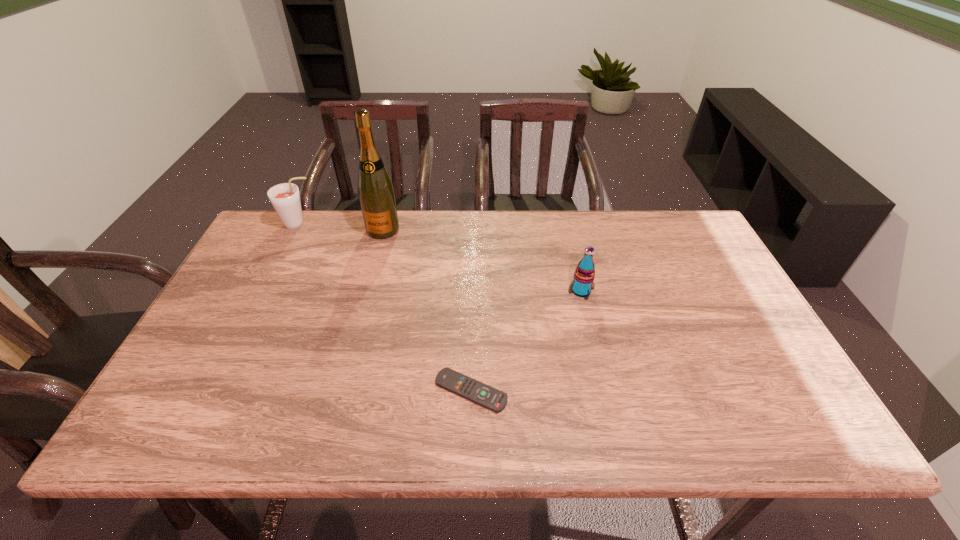
Image resolution: width=960 pixels, height=540 pixels. I want to click on empty location between the tallest object and the leftmost object, so click(x=341, y=227).

The width and height of the screenshot is (960, 540). What are the coordinates of `blank region between the leftmost object and the nearest object` in the screenshot? It's located at 385,308.

Locate an element on the screen. The height and width of the screenshot is (540, 960). vacant space in between the second object from right to left and the soda is located at coordinates (526, 341).

The width and height of the screenshot is (960, 540). I want to click on object that is the nearest to the nearest object, so click(x=584, y=275).

Locate an element on the screen. object that stands as the closest to the leftmost object is located at coordinates (376, 193).

At what (x,y) coordinates should I click in order to perform the action: click on vacant area that satisfies the following two spatial constraints: 1. on the drink side of the leftmost object; 2. on the right side of the remote control. Please return your answer as a coordinate pair (x, y). The image size is (960, 540). Looking at the image, I should click on (215, 391).

What are the coordinates of `blank area in the image that satisfies the following two spatial constraints: 1. on the front-facing side of the soda; 2. on the left side of the tallest object` in the screenshot? It's located at (367, 291).

Identify the location of free spot that satisfies the following two spatial constraints: 1. on the drink side of the root beer; 2. on the back side of the rightmost object. The height and width of the screenshot is (540, 960). (266, 291).

This screenshot has width=960, height=540. What are the coordinates of `blank space that satisfies the following two spatial constraints: 1. on the drink side of the shortest object; 2. on the left side of the leftmost object` in the screenshot? It's located at (215, 391).

Where is `vacant space that satisfies the following two spatial constraints: 1. on the drink side of the third object from left to right; 2. on the right side of the leftmost object`? This screenshot has height=540, width=960. vacant space that satisfies the following two spatial constraints: 1. on the drink side of the third object from left to right; 2. on the right side of the leftmost object is located at coordinates (215, 391).